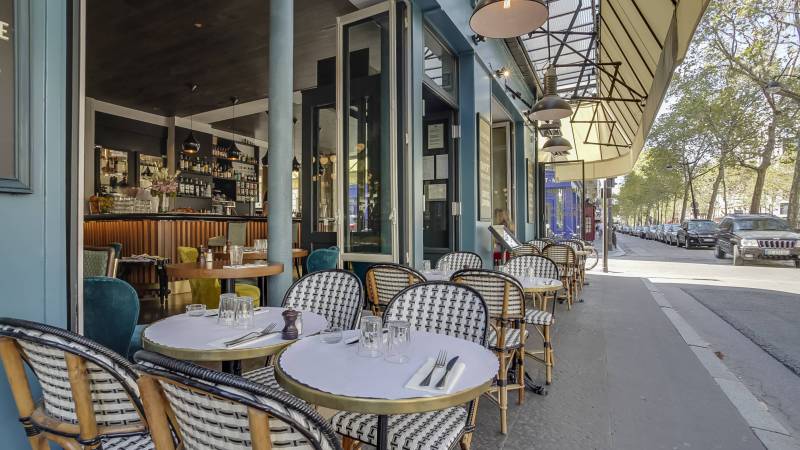
At what (x,y) coordinates should I click in order to perform the action: click on tables. Please return your answer as a coordinate pair (x, y). Image resolution: width=800 pixels, height=450 pixels. Looking at the image, I should click on (217, 262), (256, 252), (140, 261), (340, 371), (530, 284), (442, 273), (585, 247).